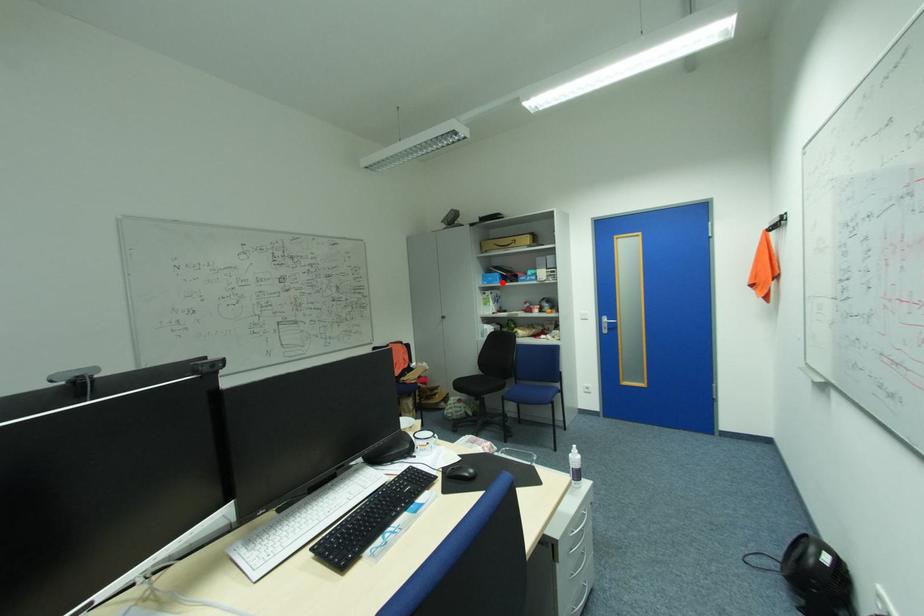
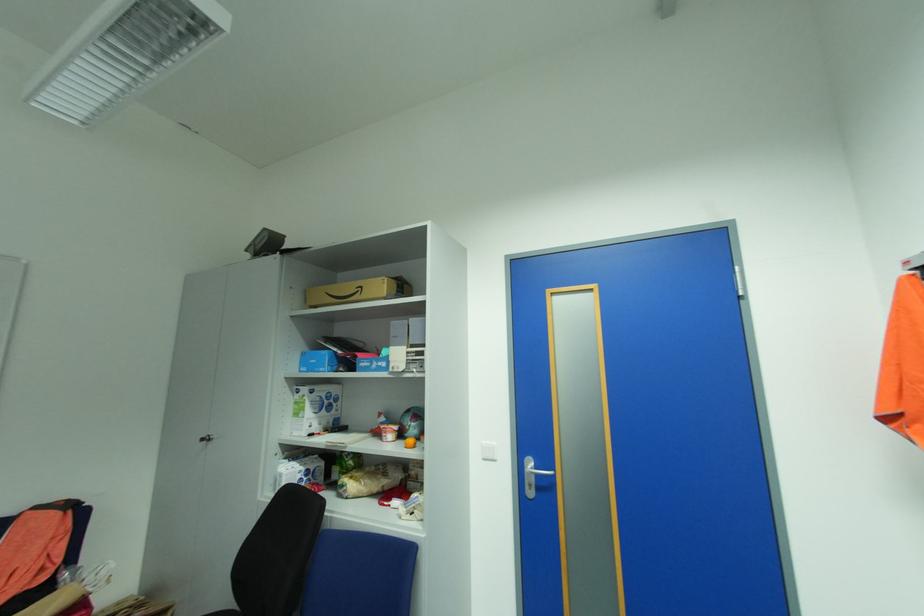
Find the pixel in the second image that matches the highlighted location in the first image.

(327, 370)